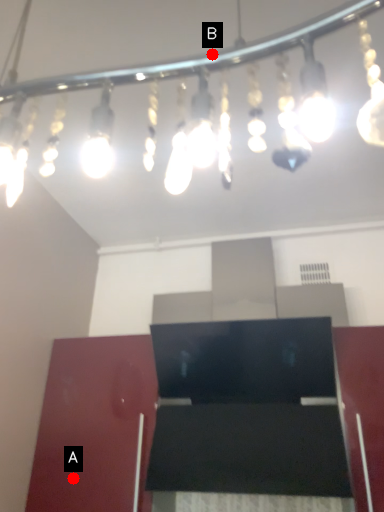
Question: Two points are circled on the image, labeled by A and B beside each circle. Which point is farther to the camera?

Choices:
 (A) A is further
 (B) B is further

Answer: (A)